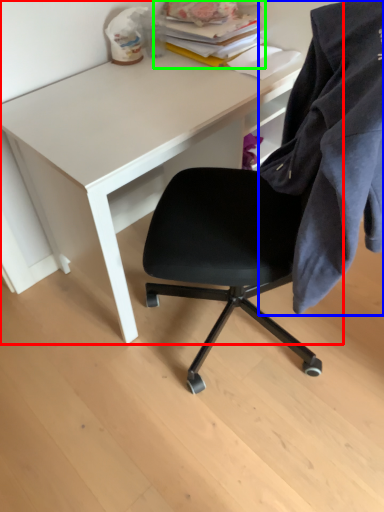
Question: Which object is positioned closest to desk (highlighted by a red box)? Select from cloth (highlighted by a blue box) and book (highlighted by a green box).

Choices:
 (A) cloth
 (B) book

Answer: (B)